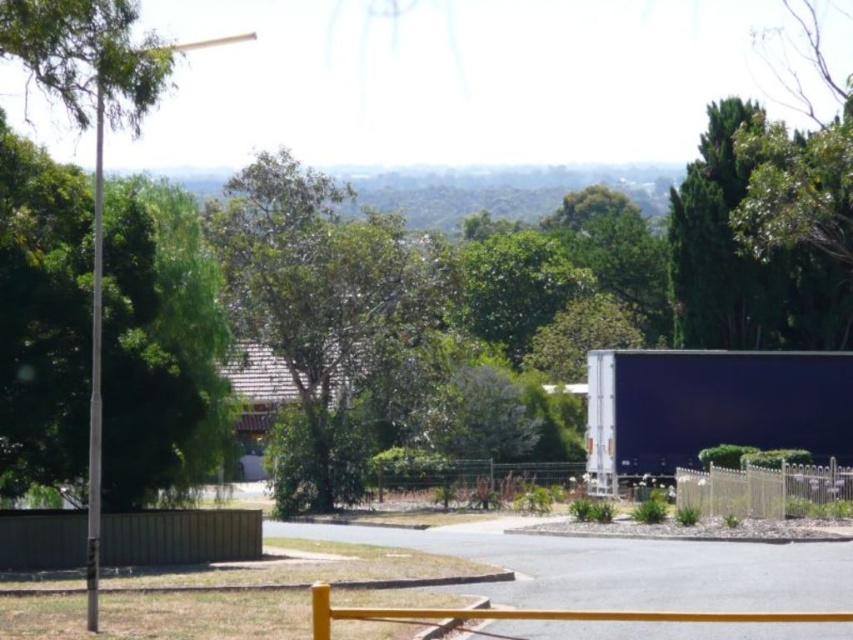
You are standing at the camera position looking at the suburban scene. There are two points marked in the image, one at coordinate point (215,525) and another at point (706,472). Which point is closer to you?

Point (215,525) is closer to the camera than point (706,472).